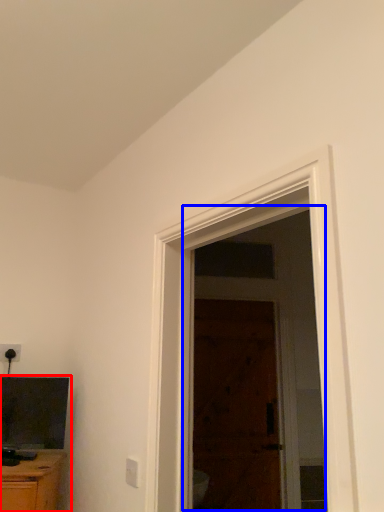
Question: Which point is closer to the camera, entertainment center (highlighted by a red box) or screen door (highlighted by a blue box)?

Choices:
 (A) entertainment center
 (B) screen door

Answer: (A)